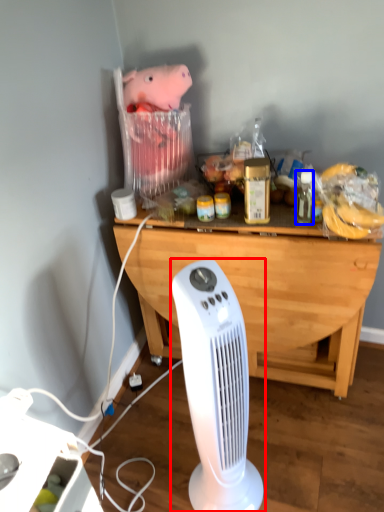
Question: Among these objects, which one is nearest to the camera, home appliance (highlighted by a red box) or bottle (highlighted by a blue box)?

Choices:
 (A) home appliance
 (B) bottle

Answer: (A)